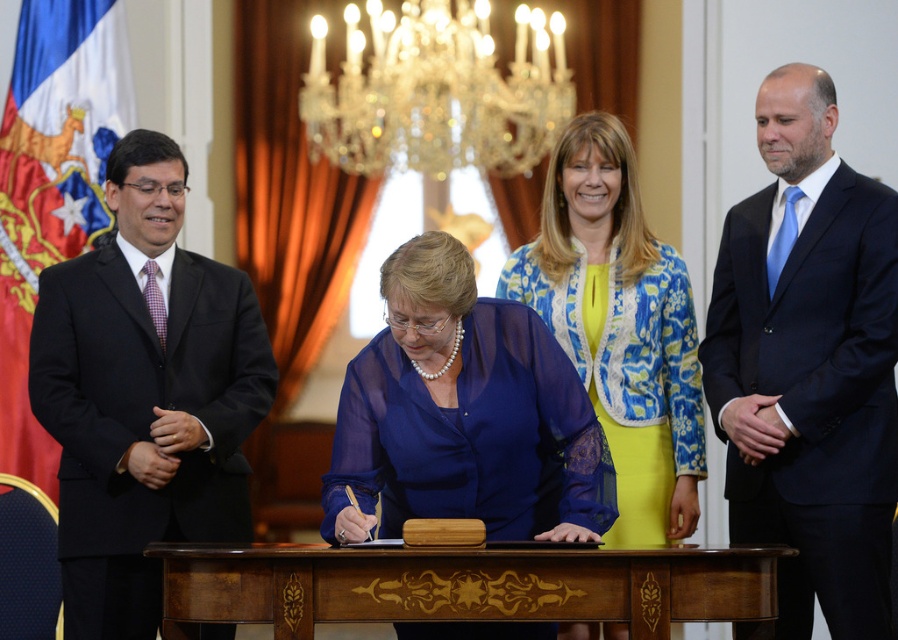
Which is below, black suit at left or wooden at center?

Positioned lower is wooden at center.

Between black suit at left and wooden at center, which one has less height?

Standing shorter between the two is wooden at center.

Which is in front, point (58, 288) or point (720, 596)?

Point (720, 596) is in front.

I want to click on black suit at left, so click(x=144, y=394).

Who is more distant from viewer, (179, 214) or (317, 141)?

The point (317, 141) is more distant.

Can you confirm if black suit at left is positioned below crystal glass chandelier at upper center?

Correct, black suit at left is located below crystal glass chandelier at upper center.

This screenshot has width=898, height=640. Identify the location of black suit at left. (144, 394).

At what (x,y) coordinates should I click in order to perform the action: click on black suit at left. Please return your answer as a coordinate pair (x, y). This screenshot has height=640, width=898. Looking at the image, I should click on (144, 394).

Is the position of blue silk suit at right more distant than that of crystal glass chandelier at upper center?

No, it is not.

Locate an element on the screen. The width and height of the screenshot is (898, 640). blue silk suit at right is located at coordinates (808, 364).